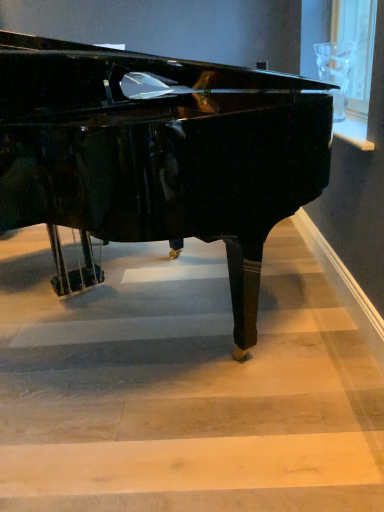
Question: Are wooden stairwell at center and glossy black piano at center making contact?

Choices:
 (A) yes
 (B) no

Answer: (B)

Question: Does wooden stairwell at center come in front of glossy black piano at center?

Choices:
 (A) no
 (B) yes

Answer: (A)

Question: Considering the relative sizes of wooden stairwell at center and glossy black piano at center in the image provided, is wooden stairwell at center taller than glossy black piano at center?

Choices:
 (A) yes
 (B) no

Answer: (B)

Question: Is the position of wooden stairwell at center more distant than that of glossy black piano at center?

Choices:
 (A) yes
 (B) no

Answer: (A)

Question: From a real-world perspective, is wooden stairwell at center over glossy black piano at center?

Choices:
 (A) yes
 (B) no

Answer: (B)

Question: From the image's perspective, is wooden stairwell at center located above or below transparent glass at upper right?

Choices:
 (A) below
 (B) above

Answer: (A)

Question: From their relative heights in the image, would you say wooden stairwell at center is taller or shorter than transparent glass at upper right?

Choices:
 (A) short
 (B) tall

Answer: (A)

Question: From a real-world perspective, is wooden stairwell at center physically located above or below transparent glass at upper right?

Choices:
 (A) above
 (B) below

Answer: (B)

Question: Is wooden stairwell at center spatially inside transparent glass at upper right, or outside of it?

Choices:
 (A) outside
 (B) inside

Answer: (A)

Question: From the image's perspective, is glossy black piano at center located above or below wooden stairwell at center?

Choices:
 (A) below
 (B) above

Answer: (B)

Question: From a real-world perspective, is glossy black piano at center physically located above or below wooden stairwell at center?

Choices:
 (A) below
 (B) above

Answer: (B)

Question: Considering their positions, is glossy black piano at center located in front of or behind wooden stairwell at center?

Choices:
 (A) behind
 (B) front

Answer: (B)

Question: Looking at the image, does glossy black piano at center seem bigger or smaller compared to wooden stairwell at center?

Choices:
 (A) big
 (B) small

Answer: (A)

Question: Looking at their shapes, would you say wooden stairwell at center is wider or thinner than glossy black piano at center?

Choices:
 (A) wide
 (B) thin

Answer: (A)

Question: Relative to glossy black piano at center, is wooden stairwell at center in front or behind?

Choices:
 (A) behind
 (B) front

Answer: (A)